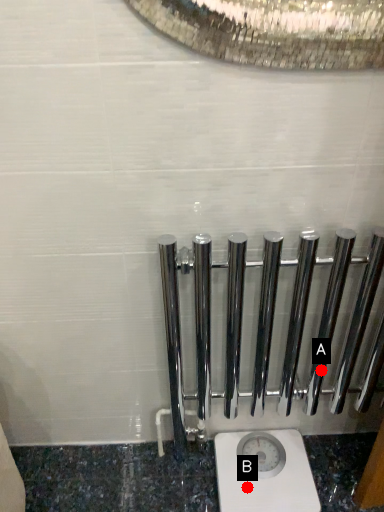
Question: Two points are circled on the image, labeled by A and B beside each circle. Among these points, which one is nearest to the camera?

Choices:
 (A) A is closer
 (B) B is closer

Answer: (B)